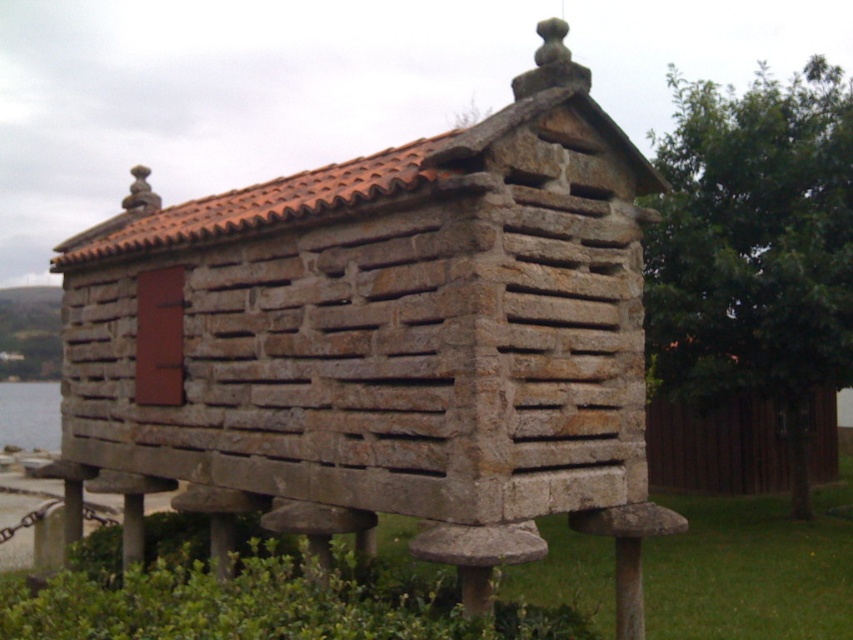
You are standing in front of the horreo and notice a specific point marked at coordinates point (244,602). Based on the scene, where is this point located in relation to the horreo?

The point (244,602) is on green grass at lower center, which is near the base of the horreo since the structure is elevated on wooden posts and the grass would be at the lower part of the image.

You are standing in front of a traditional stone granary called a horreo. You notice green grass at lower center and clear water at lower left. Which of these two is shorter?

The green grass at lower center is shorter than the clear water at lower left.